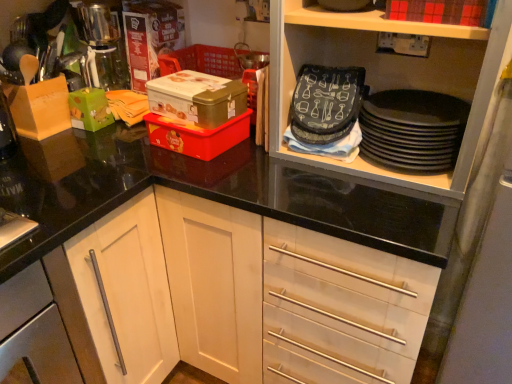
The width and height of the screenshot is (512, 384). I want to click on vacant space that is to the left of black matte plates at upper right, so click(314, 187).